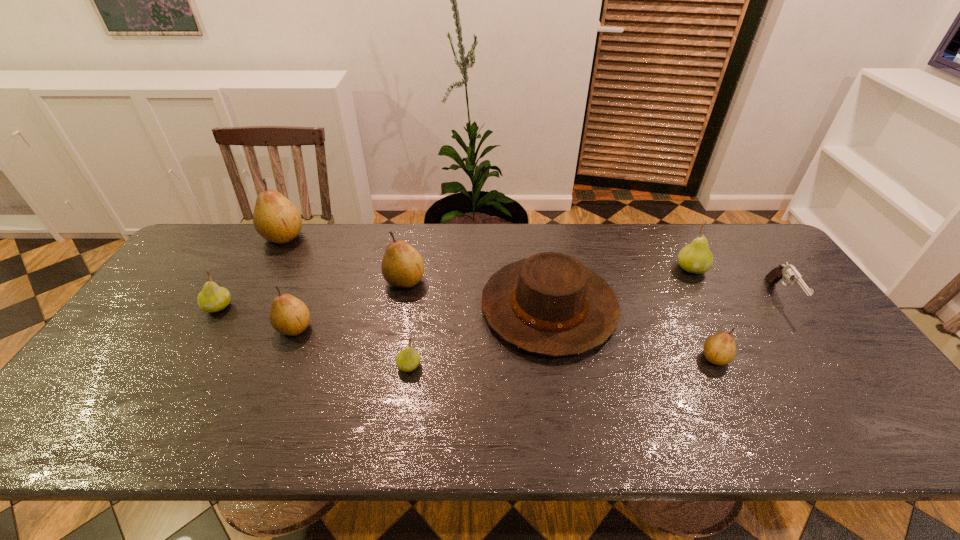
What are the coordinates of `vacant space located on the front of the second nearest green pear` in the screenshot? It's located at (204, 331).

Find the location of a particular element. vacant area situated 0.150m on the right of the third farthest brown pear is located at coordinates (369, 327).

The height and width of the screenshot is (540, 960). Identify the location of vacant space situated at the muzzle of the rightmost object. (880, 434).

Find the location of a particular element. vacant position located 0.130m on the right of the smallest green pear is located at coordinates (473, 366).

Identify the location of vacant point located on the back of the smallest brown pear. (702, 332).

Locate an element on the screen. cowboy hat at the far edge is located at coordinates (549, 304).

Identify the location of object at the right edge. The height and width of the screenshot is (540, 960). (789, 272).

Image resolution: width=960 pixels, height=540 pixels. Identify the location of free point at the far edge. (511, 247).

Identify the location of free location at the near edge. The width and height of the screenshot is (960, 540). (177, 442).

Locate an element on the screen. This screenshot has height=540, width=960. blank space at the left edge of the desktop is located at coordinates (120, 389).